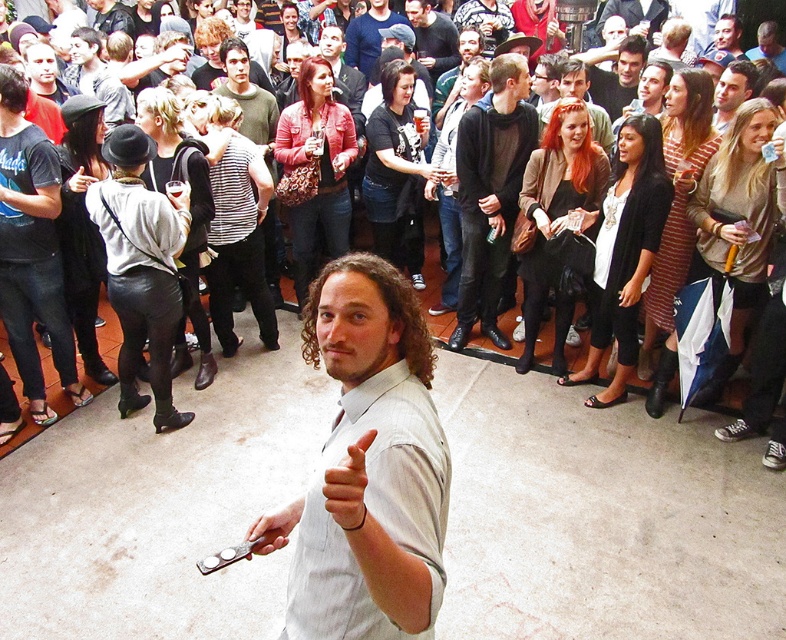
You are at a party and need to decide which clothing item to wear tomorrow. You see the light gray shirt at center and the matte black leather jacket at center in the image. Which one is wider?

The light gray shirt at center is wider than the matte black leather jacket at center.